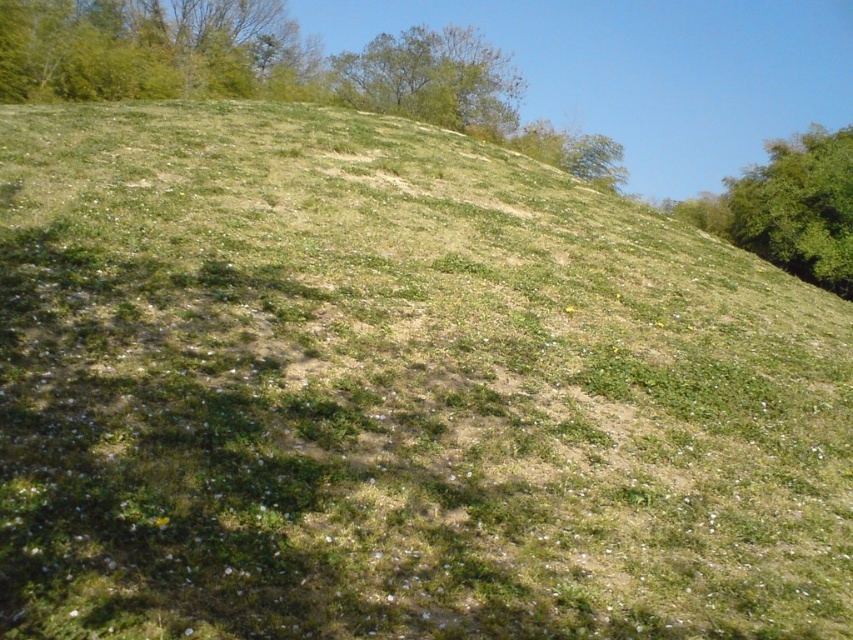
Question: From the image, what is the correct spatial relationship of green leafy tree at upper left in relation to green leafy tree at upper right?

Choices:
 (A) left
 (B) right

Answer: (A)

Question: Can you confirm if green leafy tree at upper left is bigger than green leafy tree at upper center?

Choices:
 (A) yes
 (B) no

Answer: (A)

Question: Does green leafy tree at upper right appear on the right side of green leafy tree at upper center?

Choices:
 (A) no
 (B) yes

Answer: (B)

Question: Among these points, which one is farthest from the camera?

Choices:
 (A) (229, 88)
 (B) (726, 221)

Answer: (B)

Question: Among these objects, which one is nearest to the camera?

Choices:
 (A) green leafy tree at upper center
 (B) green leafy tree at upper left
 (C) green leafy tree at upper right

Answer: (B)

Question: Which point is closer to the camera?

Choices:
 (A) (845, 291)
 (B) (426, 58)
 (C) (166, 77)

Answer: (A)